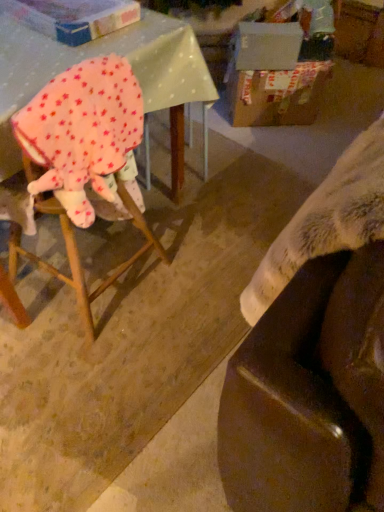
The width and height of the screenshot is (384, 512). I want to click on free space on the front side of wooden chair at left, so 75,368.